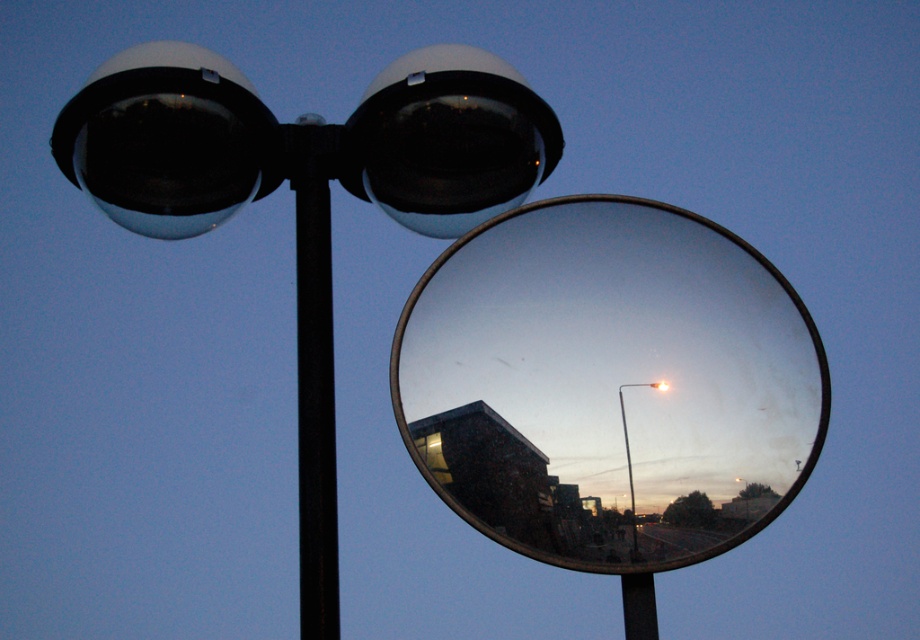
You are a city planner analyzing the street layout. You notice the matte black lamp post at upper center and the metallic silver pole at center. Which one appears bigger in the scene?

The matte black lamp post at upper center has a larger size compared to the metallic silver pole at center, so it appears bigger in the scene.

You are standing in the street scene and notice both the metallic silver pole at center and the metallic silver street light at center. Which object is located higher up in the image?

The metallic silver pole at center is positioned over the metallic silver street light at center, so it is higher up in the image.